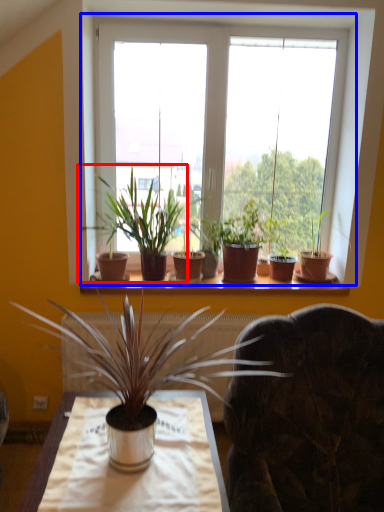
Question: Which of the following is the farthest to the observer, houseplant (highlighted by a red box) or window (highlighted by a blue box)?

Choices:
 (A) houseplant
 (B) window

Answer: (B)